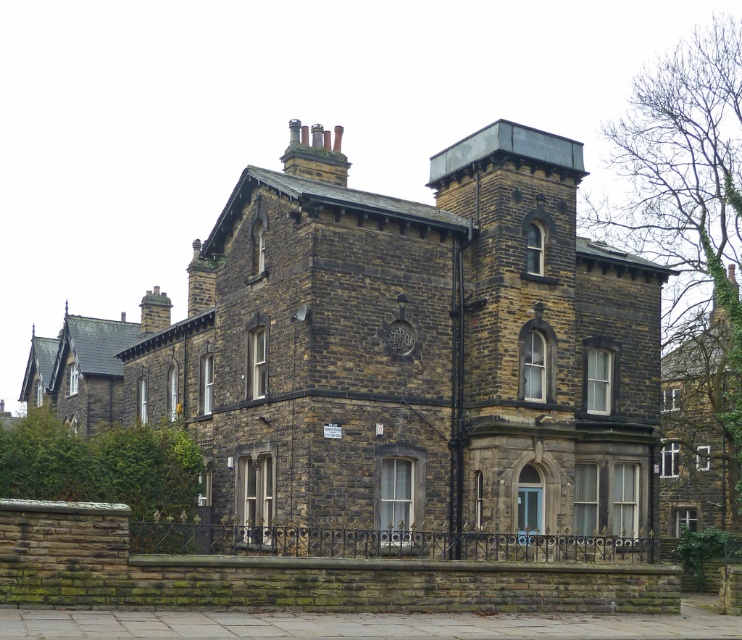
Is point (318, 164) more distant than point (168, 316)?

That is False.

Is dark gray stone chimney at upper center shorter than dark brown stone chimney at upper left?

Yes, dark gray stone chimney at upper center is shorter than dark brown stone chimney at upper left.

Between point (289, 128) and point (139, 314), which one is positioned in front?

Point (289, 128)

The height and width of the screenshot is (640, 742). I want to click on dark gray stone chimney at upper center, so click(x=315, y=154).

Does brown stone chimney at upper center lie in front of green ivy-covered chimney at upper right?

Yes, brown stone chimney at upper center is in front of green ivy-covered chimney at upper right.

Is point (188, 300) positioned before point (732, 262)?

Yes, it is in front of point (732, 262).

Locate an element on the screen. Image resolution: width=742 pixels, height=640 pixels. brown stone chimney at upper center is located at coordinates (200, 282).

Between brown stone chimney at upper center and dark brown stone chimney at upper left, which one appears on the right side from the viewer's perspective?

brown stone chimney at upper center

Who is lower down, brown stone chimney at upper center or dark brown stone chimney at upper left?

dark brown stone chimney at upper left

Is point (203, 275) positioned in front of point (160, 305)?

Yes, it is.

Identify the location of brown stone chimney at upper center. Image resolution: width=742 pixels, height=640 pixels. (200, 282).